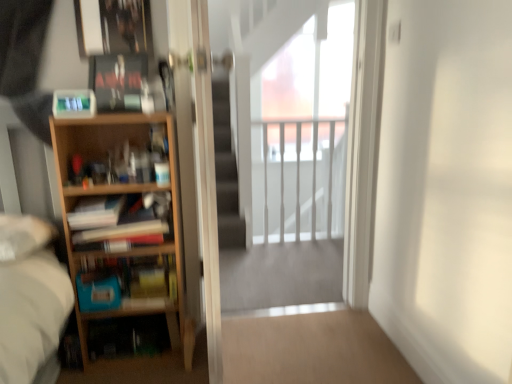
What do you see at coordinates (113, 27) in the screenshot? I see `metallic silver picture frame at upper left` at bounding box center [113, 27].

The height and width of the screenshot is (384, 512). I want to click on white glossy railing at upper center, so click(x=302, y=131).

Image resolution: width=512 pixels, height=384 pixels. What do you see at coordinates (118, 81) in the screenshot? I see `matte black book at upper left, which is counted as the 1th book, starting from the top` at bounding box center [118, 81].

The width and height of the screenshot is (512, 384). Identify the location of transparent glass screen door at center, the 1th screen door when ordered from left to right. (197, 167).

Where is `metallic silver picture frame at upper left`? The image size is (512, 384). metallic silver picture frame at upper left is located at coordinates (113, 27).

Looking at their sizes, would you say light wood bookcase at left is wider or thinner than matte black book at upper left?

light wood bookcase at left is wider than matte black book at upper left.

From a real-world perspective, is light wood bookcase at left located higher than matte black book at upper left?

No, from a real-world perspective, light wood bookcase at left is not above matte black book at upper left.

Which is nearer, [165,251] or [88,100]?

Clearly, point [165,251] is more distant from the camera than point [88,100].

Based on the photo, does light wood bookcase at left lie behind matte black book at upper left?

No, it is in front of matte black book at upper left.

Can you confirm if metallic silver picture frame at upper left is taller than wooden bookshelf at left, the second book positioned from the bottom?

Correct, metallic silver picture frame at upper left is much taller as wooden bookshelf at left, the second book positioned from the bottom.

This screenshot has width=512, height=384. I want to click on picture frame behind the wooden bookshelf at left, the second book viewed from the top, so click(x=113, y=27).

From a real-world perspective, is metallic silver picture frame at upper left positioned above or below wooden bookshelf at left, the second book positioned from the bottom?

In terms of real-world spatial position, metallic silver picture frame at upper left is above wooden bookshelf at left, the second book positioned from the bottom.

In terms of size, does metallic silver picture frame at upper left appear bigger or smaller than wooden bookshelf at left, the second book positioned from the bottom?

Clearly, metallic silver picture frame at upper left is smaller in size than wooden bookshelf at left, the second book positioned from the bottom.

How far apart are light wood bookcase at left and wooden bookshelf at left, the second book viewed from the top?

14.39 centimeters.

Does light wood bookcase at left have a lesser height compared to wooden bookshelf at left, the second book viewed from the top?

No, light wood bookcase at left is not shorter than wooden bookshelf at left, the second book viewed from the top.

Does light wood bookcase at left come in front of wooden bookshelf at left, the second book positioned from the bottom?

Yes, it is in front of wooden bookshelf at left, the second book positioned from the bottom.

How different are the orientations of light wood bookcase at left and wooden bookshelf at left, the second book positioned from the bottom, in degrees?

The angular difference between light wood bookcase at left and wooden bookshelf at left, the second book positioned from the bottom, is 0.386 degrees.

Where is `book that is the 1st object directly below the white glossy railing at upper center (from a real-world perspective)`? Image resolution: width=512 pixels, height=384 pixels. book that is the 1st object directly below the white glossy railing at upper center (from a real-world perspective) is located at coordinates (132, 224).

Based on the photo, which object is further away from the camera, wooden bookshelf at left, the second book positioned from the bottom, or white glossy railing at upper center?

white glossy railing at upper center is further from the camera.

Which is behind, point (131, 202) or point (268, 114)?

The point (268, 114) is behind.

Considering the relative positions of wooden bookshelf at left, which appears as the 1th book when ordered from the bottom, and light wood bookcase at left in the image provided, is wooden bookshelf at left, which appears as the 1th book when ordered from the bottom, to the left or to the right of light wood bookcase at left?

Clearly, wooden bookshelf at left, which appears as the 1th book when ordered from the bottom, is on the left of light wood bookcase at left in the image.

Based on the photo, from the image's perspective, is wooden bookshelf at left, which appears as the 1th book when ordered from the bottom, located above or below light wood bookcase at left?

wooden bookshelf at left, which appears as the 1th book when ordered from the bottom, is situated lower than light wood bookcase at left in the image.

Which of these two, wooden bookshelf at left, which is counted as the 3th book, starting from the top, or light wood bookcase at left, is smaller?

wooden bookshelf at left, which is counted as the 3th book, starting from the top, is smaller.

Is wooden bookshelf at left, which is counted as the 3th book, starting from the top, not within light wood bookcase at left?

That's incorrect, wooden bookshelf at left, which is counted as the 3th book, starting from the top, is not completely outside light wood bookcase at left.

Locate an element on the screen. picture frame that appears above the wooden bookshelf at left, which is counted as the 3th book, starting from the top (from a real-world perspective) is located at coordinates (113, 27).

Is wooden bookshelf at left, which appears as the 1th book when ordered from the bottom, to the left of metallic silver picture frame at upper left from the viewer's perspective?

In fact, wooden bookshelf at left, which appears as the 1th book when ordered from the bottom, is to the right of metallic silver picture frame at upper left.

From a real-world perspective, who is located lower, wooden bookshelf at left, which appears as the 1th book when ordered from the bottom, or metallic silver picture frame at upper left?

wooden bookshelf at left, which appears as the 1th book when ordered from the bottom, is physically lower.

Is matte black book at upper left smaller than matte black book at upper left, the third book in the bottom-to-top sequence?

Yes, matte black book at upper left is smaller than matte black book at upper left, the third book in the bottom-to-top sequence.

From a real-world perspective, is matte black book at upper left above or below matte black book at upper left, the third book in the bottom-to-top sequence?

matte black book at upper left is situated lower than matte black book at upper left, the third book in the bottom-to-top sequence, in the real world.

From the picture: Between matte black book at upper left and matte black book at upper left, the third book in the bottom-to-top sequence, which one is positioned in front?

matte black book at upper left is in front.

From the image's perspective, is matte black book at upper left located above or below matte black book at upper left, the third book in the bottom-to-top sequence?

matte black book at upper left is below matte black book at upper left, the third book in the bottom-to-top sequence.

Identify the location of bookcase on the right of the matte black book at upper left. (122, 192).

Which book is the 2nd one when counting from the front of the metallic silver picture frame at upper left? Please provide its 2D coordinates.

[(132, 224)]

Considering their positions, is matte black book at upper left positioned closer to matte black book at upper left, which is counted as the 1th book, starting from the top, than wooden bookshelf at left, which is counted as the 3th book, starting from the top?

Among the two, matte black book at upper left is located nearer to matte black book at upper left, which is counted as the 1th book, starting from the top.

When comparing their distances from light wood bookcase at left, does white glossy railing at upper center or metallic silver picture frame at upper left seem further?

white glossy railing at upper center is further to light wood bookcase at left.

Estimate the real-world distances between objects in this image. Which object is further from wooden bookshelf at left, which appears as the 1th book when ordered from the bottom, matte black book at upper left or metallic silver picture frame at upper left?

Among the two, metallic silver picture frame at upper left is located further to wooden bookshelf at left, which appears as the 1th book when ordered from the bottom.

In the scene shown: Which object lies further to the anchor point matte black book at upper left, white glossy railing at upper center or light wood bookcase at left?

white glossy railing at upper center is positioned further to the anchor matte black book at upper left.

Estimate the real-world distances between objects in this image. Which object is closer to matte black book at upper left, which is counted as the 1th book, starting from the top, white glossy railing at upper center or light wood bookcase at left?

light wood bookcase at left is positioned closer to the anchor matte black book at upper left, which is counted as the 1th book, starting from the top.

Which object lies further to the anchor point white glossy railing at upper center, wooden bookshelf at left, the second book viewed from the top, or transparent glass screen door at center, which is counted as the second screen door, starting from the left?

wooden bookshelf at left, the second book viewed from the top, is positioned further to the anchor white glossy railing at upper center.

Which object lies further to the anchor point matte black book at upper left, the third book in the bottom-to-top sequence, matte black book at upper left or transparent glass screen door at center, the 2th screen door positioned from the right?

The object further to matte black book at upper left, the third book in the bottom-to-top sequence, is transparent glass screen door at center, the 2th screen door positioned from the right.

From the image, which object appears to be farther from wooden bookshelf at left, which appears as the 1th book when ordered from the bottom, transparent glass screen door at center, which is counted as the second screen door, starting from the left, or light wood bookcase at left?

Based on the image, transparent glass screen door at center, which is counted as the second screen door, starting from the left, appears to be further to wooden bookshelf at left, which appears as the 1th book when ordered from the bottom.

Where is `screen door between metallic silver picture frame at upper left and transparent glass screen door at center, the 2th screen door positioned from the right, from top to bottom`? The height and width of the screenshot is (384, 512). screen door between metallic silver picture frame at upper left and transparent glass screen door at center, the 2th screen door positioned from the right, from top to bottom is located at coordinates click(x=290, y=128).

At what (x,y) coordinates should I click in order to perform the action: click on paperback book between light wood bookcase at left and white glossy railing at upper center in the front-back direction. Please return your answer as a coordinate pair (x, y). Image resolution: width=512 pixels, height=384 pixels. Looking at the image, I should click on (74, 104).

Identify the location of screen door between matte black book at upper left and white glossy railing at upper center along the z-axis. (290, 128).

Find the location of a particular element. The image size is (512, 384). paperback book between matte black book at upper left, which is counted as the 1th book, starting from the top, and wooden bookshelf at left, which appears as the 1th book when ordered from the bottom, vertically is located at coordinates (74, 104).